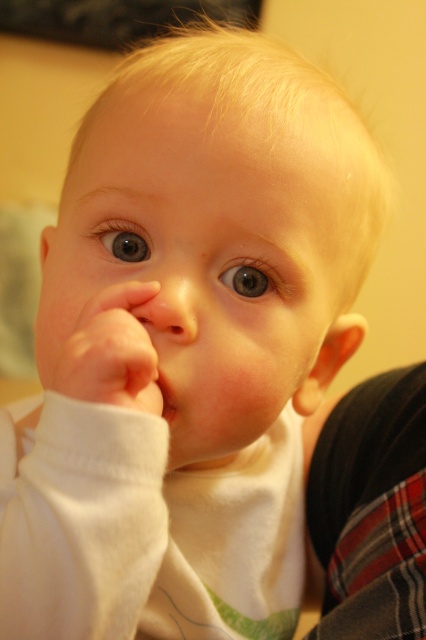
Question: Which of the following is the closest to the observer?

Choices:
 (A) white soft hand at center
 (B) pink smooth lips at center

Answer: (A)

Question: Which object appears closest to the camera in this image?

Choices:
 (A) pink smooth lips at center
 (B) white soft hand at center

Answer: (B)

Question: Observing the image, what is the correct spatial positioning of white soft hand at center in reference to pink smooth lips at center?

Choices:
 (A) left
 (B) right

Answer: (A)

Question: Is white soft hand at center smaller than pink smooth lips at center?

Choices:
 (A) no
 (B) yes

Answer: (A)

Question: Does white soft hand at center appear on the left side of pink smooth lips at center?

Choices:
 (A) yes
 (B) no

Answer: (A)